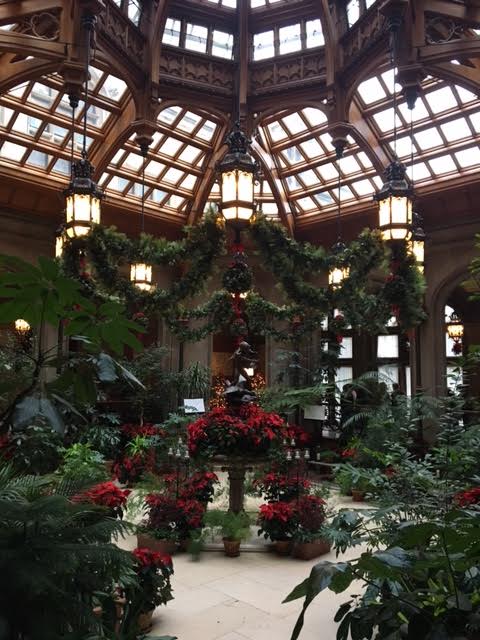
Where is `ornate wooden turnings attached to ceiling and lanterns`? The width and height of the screenshot is (480, 640). ornate wooden turnings attached to ceiling and lanterns is located at coordinates (412, 93), (339, 120), (243, 131), (149, 112), (81, 68).